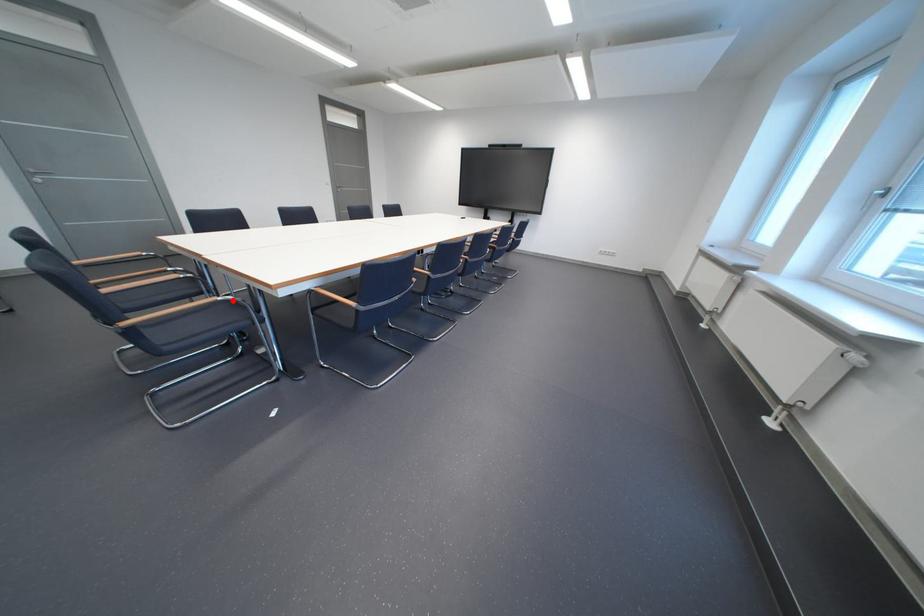
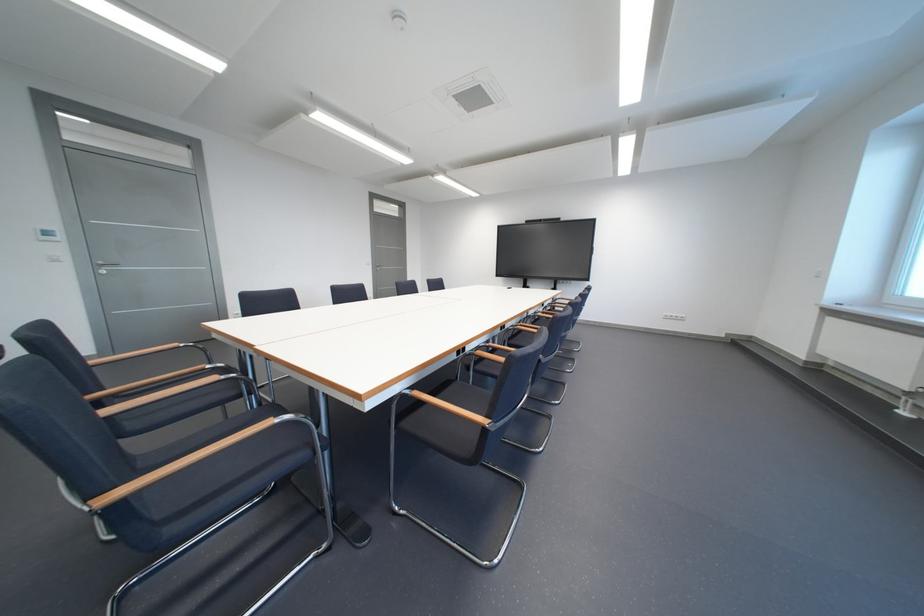
In the second image, find the point that corresponds to the highlighted location in the first image.

(289, 422)